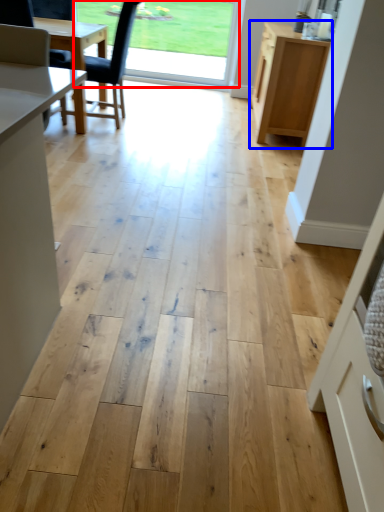
Question: Among these objects, which one is farthest to the camera, window screen (highlighted by a red box) or cabinetry (highlighted by a blue box)?

Choices:
 (A) window screen
 (B) cabinetry

Answer: (A)